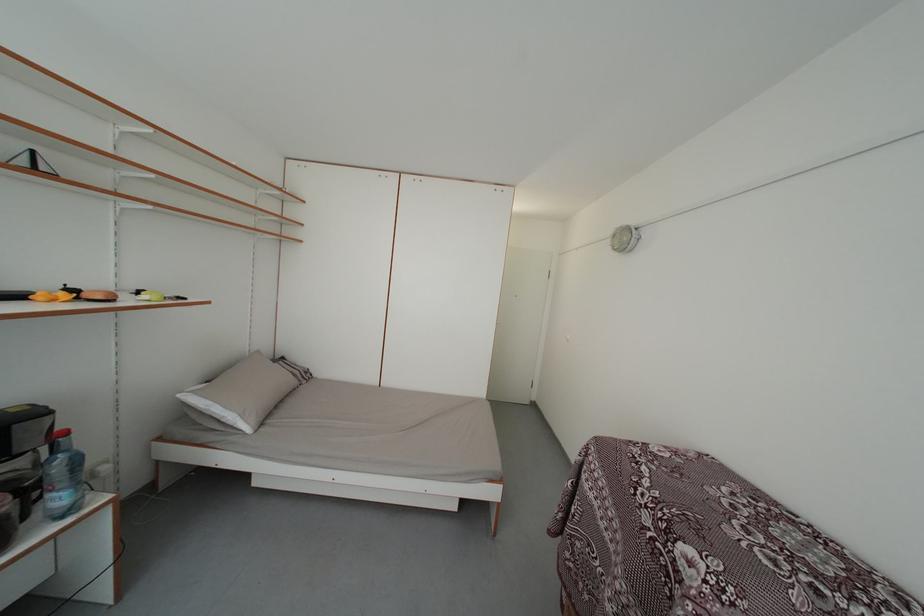
What do you see at coordinates (624, 238) in the screenshot? The width and height of the screenshot is (924, 616). I see `a round wooden object` at bounding box center [624, 238].